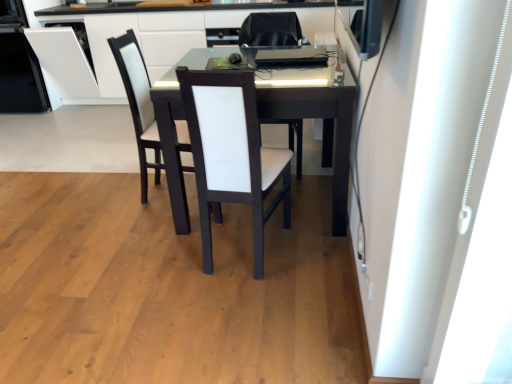
This screenshot has height=384, width=512. I want to click on free space underneath white leather chair at center, acting as the second chair starting from the back (from a real-world perspective), so click(243, 247).